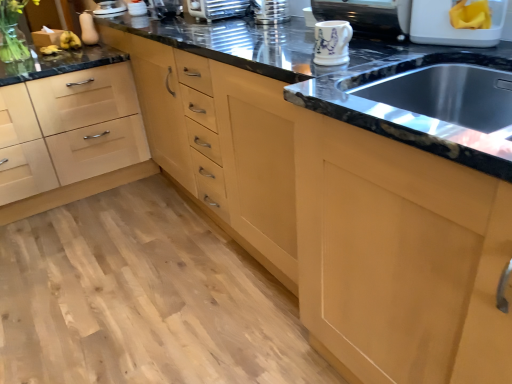
What do you see at coordinates (136, 7) in the screenshot?
I see `white glossy toaster at upper center, which is counted as the seventh appliance, starting from the right` at bounding box center [136, 7].

In order to face metallic silver toaster at upper center, the 6th appliance in the right-to-left sequence, should I rotate leftwards or rightwards?

You should look left and rotate roughly 12.913 degrees.

Find the location of `metallic silver toaster at upper center, the 4th appliance when ordered from right to left`. metallic silver toaster at upper center, the 4th appliance when ordered from right to left is located at coordinates (270, 11).

Describe the element at coordinates (368, 16) in the screenshot. Image resolution: width=512 pixels, height=384 pixels. I see `white glossy mug at upper center, the seventh appliance in the left-to-right sequence` at that location.

Describe the element at coordinates (332, 42) in the screenshot. I see `porcelain mug at upper center, the 3th appliance when ordered from right to left` at that location.

Where is `porcelain mug at upper center, which is counted as the sixth appliance, starting from the left`? The height and width of the screenshot is (384, 512). porcelain mug at upper center, which is counted as the sixth appliance, starting from the left is located at coordinates (332, 42).

The height and width of the screenshot is (384, 512). Find the location of `black granite sink at center`. black granite sink at center is located at coordinates (410, 104).

At what (x,y) coordinates should I click in order to perform the action: click on white glossy toaster at upper center, which is counted as the seventh appliance, starting from the right. Please return your answer as a coordinate pair (x, y). Looking at the image, I should click on (136, 7).

Is point (176, 9) more distant than point (38, 157)?

Yes, point (176, 9) is behind point (38, 157).

Does metallic silver toaster at upper center, acting as the third appliance starting from the left, touch light wood drawer at lower left?

No, metallic silver toaster at upper center, acting as the third appliance starting from the left, is not touching light wood drawer at lower left.

Can you confirm if metallic silver toaster at upper center, acting as the third appliance starting from the left, is smaller than light wood drawer at lower left?

Indeed, metallic silver toaster at upper center, acting as the third appliance starting from the left, has a smaller size compared to light wood drawer at lower left.

From a real-world perspective, is metallic silver toaster at upper center, the 6th appliance in the right-to-left sequence, physically below light wood drawer at lower left?

No.

Are matte white squash at upper left, the first appliance in the left-to-right sequence, and metallic silver toaster at upper center, the 6th appliance in the right-to-left sequence, beside each other?

They are not placed beside each other.

Starting from the matte white squash at upper left, the first appliance in the left-to-right sequence, which appliance is the 2nd one to the right? Please provide its 2D coordinates.

[(165, 8)]

Is matte white squash at upper left, the eighth appliance in the right-to-left sequence, positioned behind metallic silver toaster at upper center, the 6th appliance in the right-to-left sequence?

Yes, matte white squash at upper left, the eighth appliance in the right-to-left sequence, is further from the camera.

Considering the sizes of objects matte white squash at upper left, the eighth appliance in the right-to-left sequence, and light wood drawer at lower left in the image provided, who is smaller, matte white squash at upper left, the eighth appliance in the right-to-left sequence, or light wood drawer at lower left?

matte white squash at upper left, the eighth appliance in the right-to-left sequence.

Which appliance is the 4th one when counting from the back of the light wood drawer at lower left? Please provide its 2D coordinates.

[(88, 28)]

From a real-world perspective, which object stands above the other?

From a 3D spatial view, matte white squash at upper left, the eighth appliance in the right-to-left sequence, is above.

Considering the sizes of matte white squash at upper left, the first appliance in the left-to-right sequence, and light wood drawer at lower left in the image, is matte white squash at upper left, the first appliance in the left-to-right sequence, taller or shorter than light wood drawer at lower left?

matte white squash at upper left, the first appliance in the left-to-right sequence, is shorter than light wood drawer at lower left.

From the image's perspective, which one is positioned higher, porcelain mug at upper center, the 3th appliance when ordered from right to left, or white plastic container at upper right, which is counted as the eighth appliance, starting from the left?

white plastic container at upper right, which is counted as the eighth appliance, starting from the left, is shown above in the image.

Consider the image. Which of these two, porcelain mug at upper center, the 3th appliance when ordered from right to left, or white plastic container at upper right, which is counted as the eighth appliance, starting from the left, is smaller?

Smaller between the two is porcelain mug at upper center, the 3th appliance when ordered from right to left.

Is porcelain mug at upper center, the 3th appliance when ordered from right to left, not near white plastic container at upper right, which ranks as the 1th appliance in right-to-left order?

porcelain mug at upper center, the 3th appliance when ordered from right to left, is near white plastic container at upper right, which ranks as the 1th appliance in right-to-left order, not far away.

Based on the photo, considering the positions of objects light wood drawer at lower left and porcelain mug at upper center, which is counted as the sixth appliance, starting from the left, in the image provided, who is in front, light wood drawer at lower left or porcelain mug at upper center, which is counted as the sixth appliance, starting from the left,?

Positioned in front is porcelain mug at upper center, which is counted as the sixth appliance, starting from the left.

Considering the positions of point (39, 192) and point (319, 41), is point (39, 192) closer or farther from the camera than point (319, 41)?

Point (39, 192).

From a real-world perspective, is light wood drawer at lower left positioned above or below porcelain mug at upper center, the 3th appliance when ordered from right to left?

Clearly, from a real-world perspective, light wood drawer at lower left is below porcelain mug at upper center, the 3th appliance when ordered from right to left.

In the scene shown: Is metallic silver toaster at upper center, which is the fifth appliance from right to left, shorter than light wood drawer at lower left?

Yes.

Looking at their sizes, would you say metallic silver toaster at upper center, placed as the 4th appliance when sorted from left to right, is wider or thinner than light wood drawer at lower left?

metallic silver toaster at upper center, placed as the 4th appliance when sorted from left to right, is thinner than light wood drawer at lower left.

Can you confirm if metallic silver toaster at upper center, which is the fifth appliance from right to left, is positioned to the left of light wood drawer at lower left?

Incorrect, metallic silver toaster at upper center, which is the fifth appliance from right to left, is not on the left side of light wood drawer at lower left.

Is point (213, 1) positioned after point (100, 141)?

No, (213, 1) is closer to viewer.

Is metallic silver toaster at upper center, acting as the third appliance starting from the left, not near white glossy toaster at upper center, which is counted as the seventh appliance, starting from the right?

They are positioned close to each other.

Based on the photo, do you think metallic silver toaster at upper center, the 6th appliance in the right-to-left sequence, is within white glossy toaster at upper center, arranged as the 2th appliance when viewed from the left, or outside of it?

metallic silver toaster at upper center, the 6th appliance in the right-to-left sequence, is not enclosed by white glossy toaster at upper center, arranged as the 2th appliance when viewed from the left.

From a real-world perspective, relative to white glossy toaster at upper center, which is counted as the seventh appliance, starting from the right, is metallic silver toaster at upper center, the 6th appliance in the right-to-left sequence, vertically above or below?

metallic silver toaster at upper center, the 6th appliance in the right-to-left sequence, is above white glossy toaster at upper center, which is counted as the seventh appliance, starting from the right.

Which is behind, metallic silver toaster at upper center, acting as the third appliance starting from the left, or white glossy toaster at upper center, arranged as the 2th appliance when viewed from the left?

white glossy toaster at upper center, arranged as the 2th appliance when viewed from the left, is further from the camera.

At what (x,y) coordinates should I click in order to perform the action: click on drawer beneath the metallic silver toaster at upper center, the 6th appliance in the right-to-left sequence (from a real-world perspective). Please return your answer as a coordinate pair (x, y). Looking at the image, I should click on (68, 130).

This screenshot has height=384, width=512. In order to click on appliance that is the 2nd object to the left of the metallic silver toaster at upper center, acting as the third appliance starting from the left, starting at the anchor in this screenshot , I will do `click(88, 28)`.

From the image, which object appears to be nearer to light wood drawer at lower left, metallic silver toaster at upper center, which is the 5th appliance in left-to-right order, or white plastic container at upper right, which is counted as the eighth appliance, starting from the left?

The object closer to light wood drawer at lower left is metallic silver toaster at upper center, which is the 5th appliance in left-to-right order.

Considering their positions, is white glossy mug at upper center, the seventh appliance in the left-to-right sequence, positioned closer to clear glass vase at upper left than light wood drawer at lower left?

Based on the image, light wood drawer at lower left appears to be nearer to clear glass vase at upper left.

Considering their positions, is black granite sink at center positioned further to metallic silver toaster at upper center, the 4th appliance when ordered from right to left, than porcelain mug at upper center, the 3th appliance when ordered from right to left?

Based on the image, black granite sink at center appears to be further to metallic silver toaster at upper center, the 4th appliance when ordered from right to left.

Based on their spatial positions, is clear glass vase at upper left or metallic silver toaster at upper center, the 6th appliance in the right-to-left sequence, closer to metallic silver toaster at upper center, placed as the 4th appliance when sorted from left to right?

Among the two, metallic silver toaster at upper center, the 6th appliance in the right-to-left sequence, is located nearer to metallic silver toaster at upper center, placed as the 4th appliance when sorted from left to right.

Estimate the real-world distances between objects in this image. Which object is further from metallic silver toaster at upper center, which is the 5th appliance in left-to-right order, metallic silver toaster at upper center, the 6th appliance in the right-to-left sequence, or metallic silver toaster at upper center, which is the fifth appliance from right to left?

metallic silver toaster at upper center, the 6th appliance in the right-to-left sequence, lies further to metallic silver toaster at upper center, which is the 5th appliance in left-to-right order, than the other object.

Based on their spatial positions, is clear glass vase at upper left or metallic silver toaster at upper center, which is the fifth appliance from right to left, further from white glossy toaster at upper center, which is counted as the seventh appliance, starting from the right?

clear glass vase at upper left lies further to white glossy toaster at upper center, which is counted as the seventh appliance, starting from the right, than the other object.

When comparing their distances from black granite sink at center, does matte white squash at upper left, the eighth appliance in the right-to-left sequence, or white plastic container at upper right, which ranks as the 1th appliance in right-to-left order, seem further?

Based on the image, matte white squash at upper left, the eighth appliance in the right-to-left sequence, appears to be further to black granite sink at center.

Based on their spatial positions, is metallic silver toaster at upper center, placed as the 4th appliance when sorted from left to right, or white glossy toaster at upper center, arranged as the 2th appliance when viewed from the left, further from light wood drawer at lower left?

metallic silver toaster at upper center, placed as the 4th appliance when sorted from left to right.

The image size is (512, 384). Find the location of `drawer between clear glass vase at upper left and white plastic container at upper right, which ranks as the 1th appliance in right-to-left order, from left to right`. drawer between clear glass vase at upper left and white plastic container at upper right, which ranks as the 1th appliance in right-to-left order, from left to right is located at coordinates (68, 130).

Identify the location of drawer between clear glass vase at upper left and metallic silver toaster at upper center, placed as the 4th appliance when sorted from left to right. (68, 130).

You are a GUI agent. You are given a task and a screenshot of the screen. Output one action in this format:
    pyautogui.click(x=<x>, y=<y>)
    Task: Click on the appliance located between porcelain mug at upper center, which is counted as the sixth appliance, starting from the left, and white plastic container at upper right, which ranks as the 1th appliance in right-to-left order, in the left-right direction
    
    Given the screenshot: What is the action you would take?
    pyautogui.click(x=368, y=16)

You are a GUI agent. You are given a task and a screenshot of the screen. Output one action in this format:
    pyautogui.click(x=<x>, y=<y>)
    Task: Click on the appliance between white glossy toaster at upper center, which is counted as the seventh appliance, starting from the right, and metallic silver toaster at upper center, which is the fifth appliance from right to left, in the horizontal direction
    
    Given the screenshot: What is the action you would take?
    pyautogui.click(x=165, y=8)